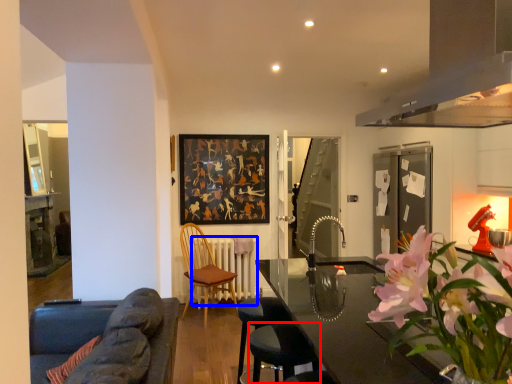
Question: Which object appears closest to the camera in this image, bar stool (highlighted by a red box) or radiator (highlighted by a blue box)?

Choices:
 (A) bar stool
 (B) radiator

Answer: (A)